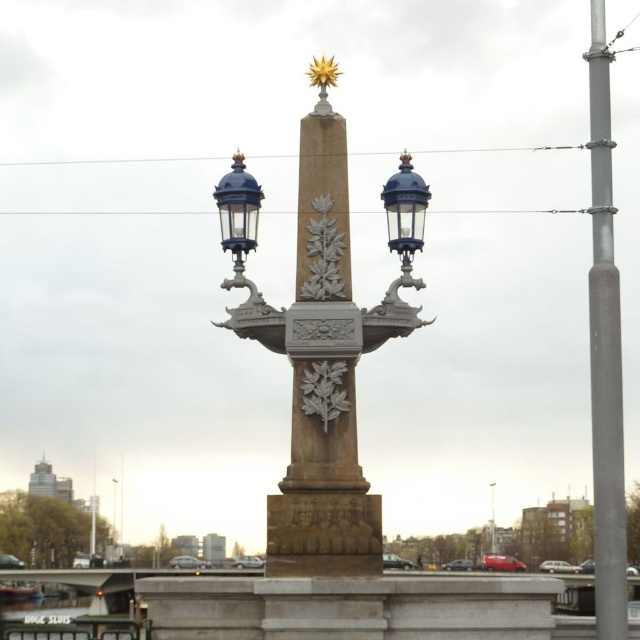
Based on the photo, does stone obelisk at center have a greater height compared to matte blue streetlight at center?

Indeed, stone obelisk at center has a greater height compared to matte blue streetlight at center.

Is point (332, 324) farther from viewer compared to point (113, 522)?

No, it is in front of (113, 522).

Is point (300, 330) positioned behind point (115, 480)?

No, (300, 330) is in front of (115, 480).

At what (x,y) coordinates should I click in order to perform the action: click on stone obelisk at center. Please return your answer as a coordinate pair (x, y). Looking at the image, I should click on (323, 342).

Is point (493, 484) positioned before point (113, 524)?

Yes.

Measure the distance between matte gray street light at center and camera.

matte gray street light at center and camera are 170.76 meters apart.

The height and width of the screenshot is (640, 640). I want to click on matte gray street light at center, so 492,518.

In the scene shown: Between silver metallic pole at right and blue glass lantern at right, which one is positioned higher?

blue glass lantern at right is above.

Who is positioned more to the right, silver metallic pole at right or blue glass lantern at right?

From the viewer's perspective, silver metallic pole at right appears more on the right side.

Does point (593, 465) lie behind point (417, 189)?

No, it is not.

Where is `silver metallic pole at right`? This screenshot has width=640, height=640. silver metallic pole at right is located at coordinates (604, 353).